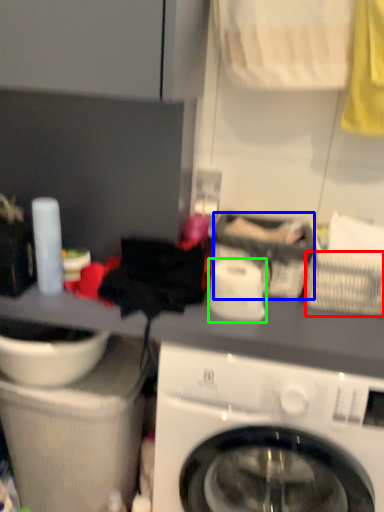
Question: Which object is the closest to the basket (highlighted by a red box)? Choose among these: basket (highlighted by a blue box) or toilet paper (highlighted by a green box).

Choices:
 (A) basket
 (B) toilet paper

Answer: (A)